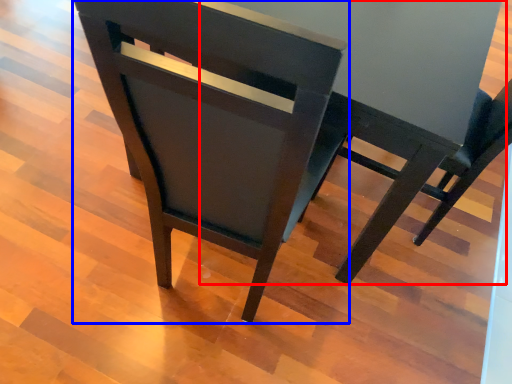
Question: Which point is further to the camera, round table (highlighted by a red box) or chair (highlighted by a blue box)?

Choices:
 (A) round table
 (B) chair

Answer: (A)